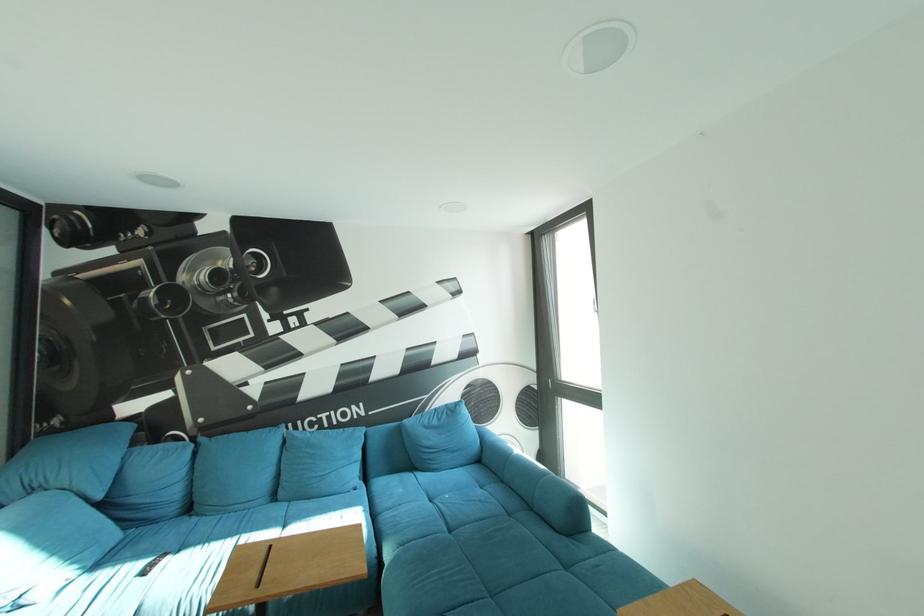
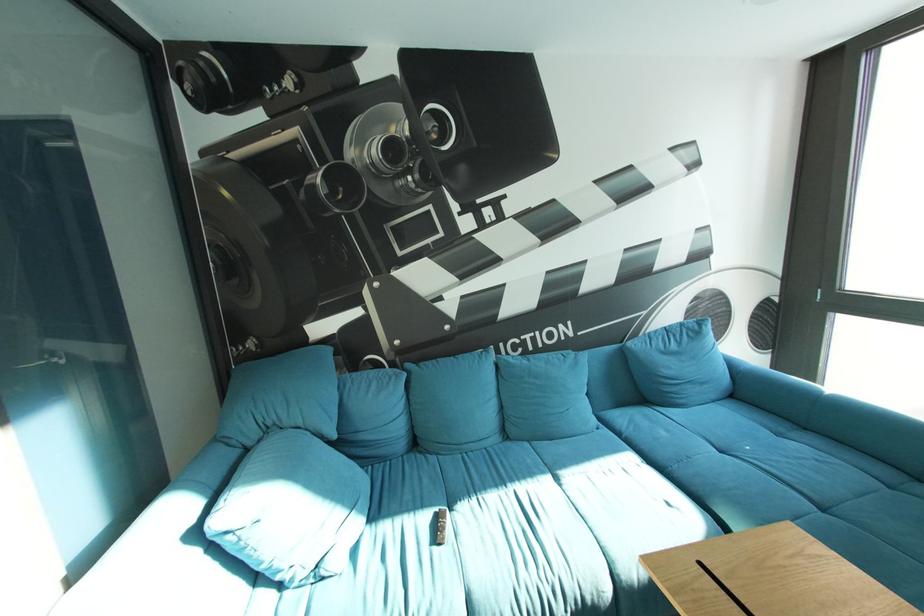
What movement of the cameraman would produce the second image?

The movement direction of the cameraman is left, forward.